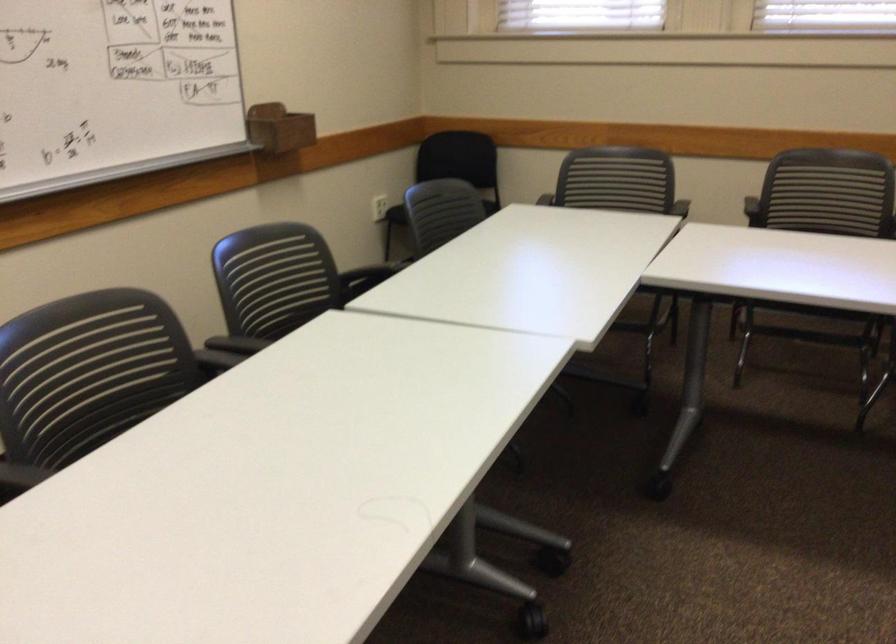
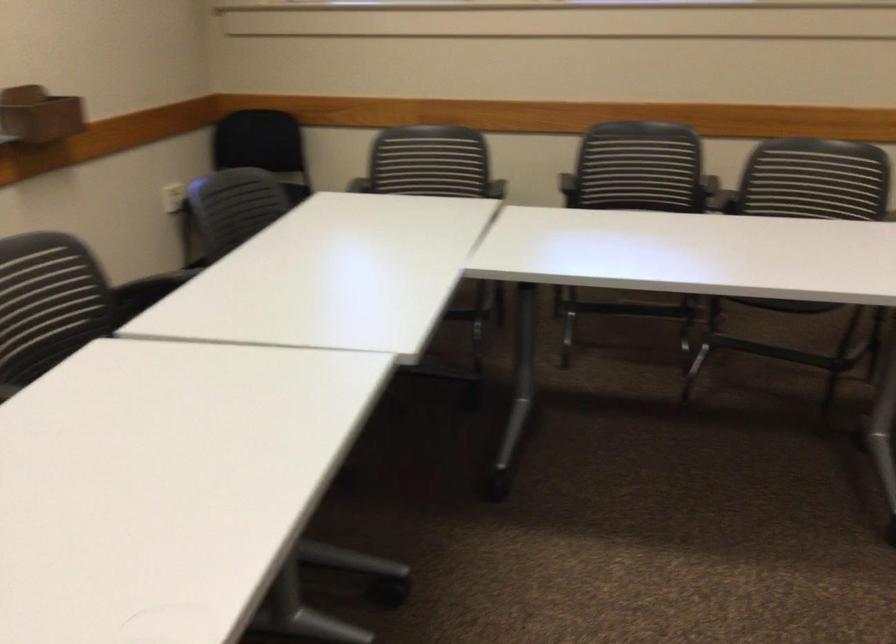
Question: The camera is either moving clockwise (left) or counter-clockwise (right) around the object. The first image is from the beginning of the video and the second image is from the end. Is the camera moving left or right when shooting the video?

Choices:
 (A) Left
 (B) Right

Answer: (A)